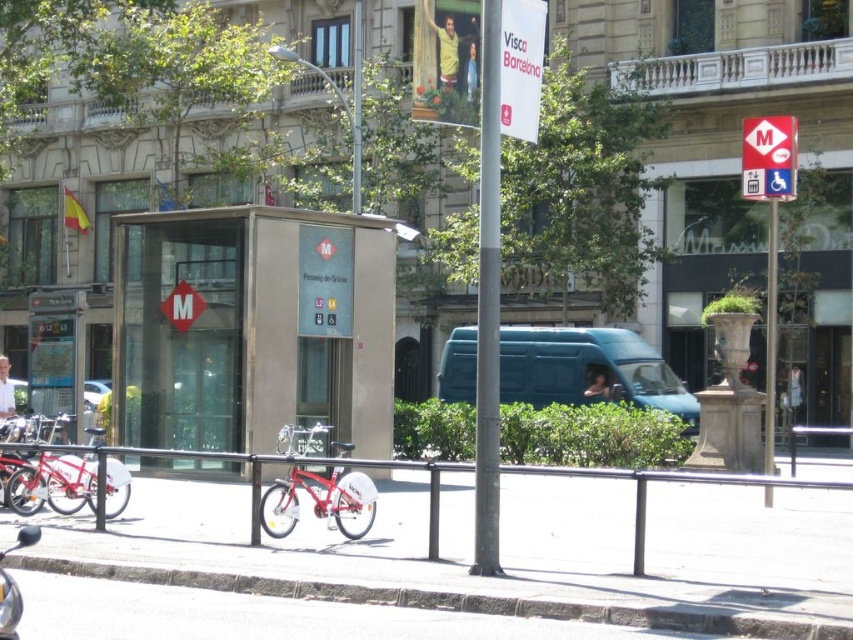
Question: Is shiny red bicycle at center below white cotton shirt at lower left?

Choices:
 (A) yes
 (B) no

Answer: (A)

Question: Can you confirm if metallic rectangular sign at upper right is wider than shiny chrome motorcycle at lower left?

Choices:
 (A) yes
 (B) no

Answer: (A)

Question: Which object appears farthest from the camera in this image?

Choices:
 (A) white cotton shirt at lower left
 (B) white concrete pavement at center

Answer: (A)

Question: Does white concrete pavement at center have a larger size compared to shiny chrome motorcycle at lower left?

Choices:
 (A) yes
 (B) no

Answer: (A)

Question: Which of the following is the closest to the observer?

Choices:
 (A) (834, 515)
 (B) (358, 483)
 (C) (746, 129)

Answer: (B)

Question: Among these objects, which one is nearest to the camera?

Choices:
 (A) shiny red bicycle at center
 (B) shiny chrome motorcycle at lower left

Answer: (B)